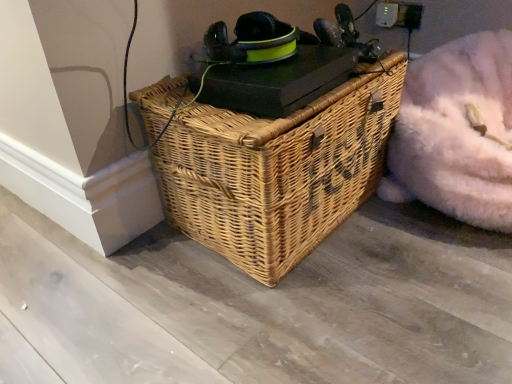
At what (x,y) coordinates should I click in order to perform the action: click on natural wicker picnic basket at center. Please return your answer as a coordinate pair (x, y). The image size is (512, 384). Looking at the image, I should click on (278, 170).

In order to face natural wicker picnic basket at center, should I rotate leftwards or rightwards?

Rotate your view right by about 3.426°.

Describe the element at coordinates (278, 170) in the screenshot. I see `natural wicker picnic basket at center` at that location.

Where is `fluffy white bean bag at lower right`? This screenshot has height=384, width=512. fluffy white bean bag at lower right is located at coordinates (456, 132).

What do you see at coordinates (456, 132) in the screenshot? I see `fluffy white bean bag at lower right` at bounding box center [456, 132].

Where is `natural wicker picnic basket at center`? Image resolution: width=512 pixels, height=384 pixels. natural wicker picnic basket at center is located at coordinates (278, 170).

In the image, is natural wicker picnic basket at center on the left side or the right side of fluffy white bean bag at lower right?

natural wicker picnic basket at center is positioned on fluffy white bean bag at lower right's left side.

Relative to fluffy white bean bag at lower right, is natural wicker picnic basket at center in front or behind?

Clearly, natural wicker picnic basket at center is in front of fluffy white bean bag at lower right.

Does point (342, 106) appear closer or farther from the camera than point (485, 176)?

Point (342, 106).

From the image's perspective, is natural wicker picnic basket at center over fluffy white bean bag at lower right?

No, from the image's perspective, natural wicker picnic basket at center is not on top of fluffy white bean bag at lower right.

From a real-world perspective, does natural wicker picnic basket at center stand above fluffy white bean bag at lower right?

Correct, in the physical world, natural wicker picnic basket at center is higher than fluffy white bean bag at lower right.

Considering the sizes of objects natural wicker picnic basket at center and fluffy white bean bag at lower right in the image provided, who is thinner, natural wicker picnic basket at center or fluffy white bean bag at lower right?

Thinner between the two is natural wicker picnic basket at center.

Can you confirm if natural wicker picnic basket at center is taller than fluffy white bean bag at lower right?

Indeed, natural wicker picnic basket at center has a greater height compared to fluffy white bean bag at lower right.

Considering the sizes of objects natural wicker picnic basket at center and fluffy white bean bag at lower right in the image provided, who is bigger, natural wicker picnic basket at center or fluffy white bean bag at lower right?

With larger size is natural wicker picnic basket at center.

Which is correct: natural wicker picnic basket at center is inside fluffy white bean bag at lower right, or outside of it?

natural wicker picnic basket at center is located beyond the bounds of fluffy white bean bag at lower right.

Is natural wicker picnic basket at center in contact with fluffy white bean bag at lower right?

natural wicker picnic basket at center is not next to fluffy white bean bag at lower right, and they're not touching.

Is natural wicker picnic basket at center facing away from fluffy white bean bag at lower right?

No.

Looking at this image, can you tell me how much natural wicker picnic basket at center and fluffy white bean bag at lower right differ in facing direction?

90 degrees separate the facing orientations of natural wicker picnic basket at center and fluffy white bean bag at lower right.

The image size is (512, 384). What are the coordinates of `bean bag chair below the natural wicker picnic basket at center (from a real-world perspective)` in the screenshot? It's located at (456, 132).

Which is more to the right, fluffy white bean bag at lower right or natural wicker picnic basket at center?

fluffy white bean bag at lower right is more to the right.

Which object is further away from the camera, fluffy white bean bag at lower right or natural wicker picnic basket at center?

fluffy white bean bag at lower right is further away from the camera.

Does point (472, 44) come in front of point (226, 140)?

No, (472, 44) is behind (226, 140).

From the image's perspective, relative to natural wicker picnic basket at center, is fluffy white bean bag at lower right above or below?

Based on their image positions, fluffy white bean bag at lower right is located above natural wicker picnic basket at center.

From a real-world perspective, is fluffy white bean bag at lower right located beneath natural wicker picnic basket at center?

Yes, from a real-world perspective, fluffy white bean bag at lower right is below natural wicker picnic basket at center.

Between fluffy white bean bag at lower right and natural wicker picnic basket at center, which one has larger width?

Wider between the two is fluffy white bean bag at lower right.

Considering the sizes of objects fluffy white bean bag at lower right and natural wicker picnic basket at center in the image provided, who is shorter, fluffy white bean bag at lower right or natural wicker picnic basket at center?

Standing shorter between the two is fluffy white bean bag at lower right.

Considering the sizes of fluffy white bean bag at lower right and natural wicker picnic basket at center in the image, is fluffy white bean bag at lower right bigger or smaller than natural wicker picnic basket at center?

Clearly, fluffy white bean bag at lower right is smaller in size than natural wicker picnic basket at center.

Could natural wicker picnic basket at center be considered to be inside fluffy white bean bag at lower right?

Actually, natural wicker picnic basket at center is outside fluffy white bean bag at lower right.

Is fluffy white bean bag at lower right next to natural wicker picnic basket at center and touching it?

They are not placed beside each other.

Could you tell me if fluffy white bean bag at lower right is facing natural wicker picnic basket at center?

No.

What's the angular difference between fluffy white bean bag at lower right and natural wicker picnic basket at center's facing directions?

fluffy white bean bag at lower right and natural wicker picnic basket at center are facing 90 degrees away from each other.

Where is `bean bag chair lying on the right of natural wicker picnic basket at center`? bean bag chair lying on the right of natural wicker picnic basket at center is located at coordinates (456, 132).

Identify the location of picnic basket lying in front of the fluffy white bean bag at lower right. Image resolution: width=512 pixels, height=384 pixels. (278, 170).

Where is `bean bag chair above the natural wicker picnic basket at center (from the image's perspective)`? bean bag chair above the natural wicker picnic basket at center (from the image's perspective) is located at coordinates (456, 132).